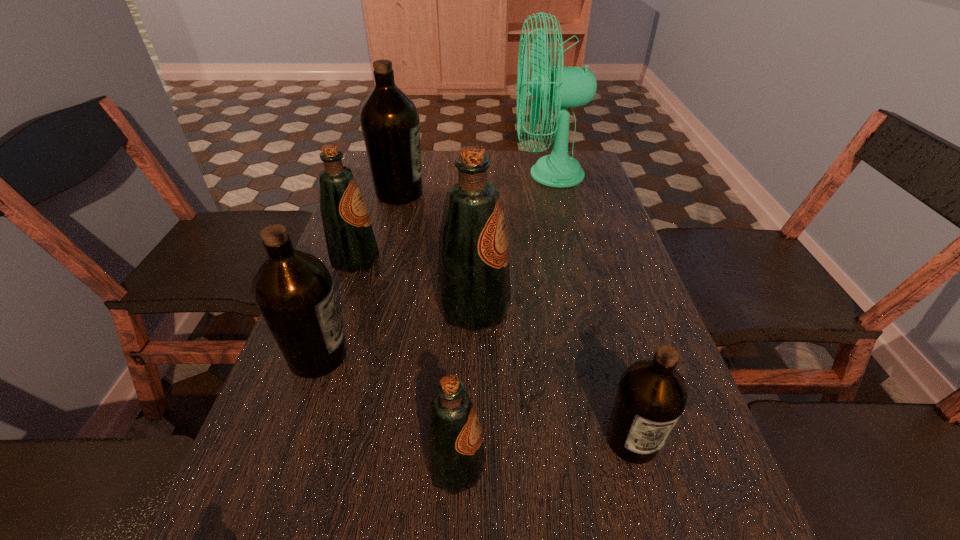
Where is `the nearest brown olive oil`? the nearest brown olive oil is located at coordinates (652, 395).

At what (x,y) coordinates should I click in order to perform the action: click on free space located 0.240m in front of the fan to blow air. Please return your answer as a coordinate pair (x, y). Looking at the image, I should click on (440, 175).

Locate an element on the screen. vacant space located 0.300m in front of the fan to blow air is located at coordinates (420, 175).

Where is `vacant region located in front of the fan to blow air`? The height and width of the screenshot is (540, 960). vacant region located in front of the fan to blow air is located at coordinates (486, 175).

This screenshot has height=540, width=960. What are the coordinates of `free point located on the front-facing side of the biggest green olive oil` in the screenshot? It's located at (642, 310).

Image resolution: width=960 pixels, height=540 pixels. In order to click on vacant region located on the label of the farthest brown olive oil in this screenshot , I will do `click(512, 193)`.

Find the location of a particular element. The height and width of the screenshot is (540, 960). vacant space located 0.150m on the front-facing side of the second smallest green olive oil is located at coordinates (441, 260).

Image resolution: width=960 pixels, height=540 pixels. Find the location of `free space located 0.260m on the label of the second smallest brown olive oil`. free space located 0.260m on the label of the second smallest brown olive oil is located at coordinates (482, 356).

Identify the location of free space located 0.340m on the front-facing side of the smallest green olive oil. (700, 467).

Identify the location of vacant space located 0.100m on the label of the rightmost olive oil. click(660, 538).